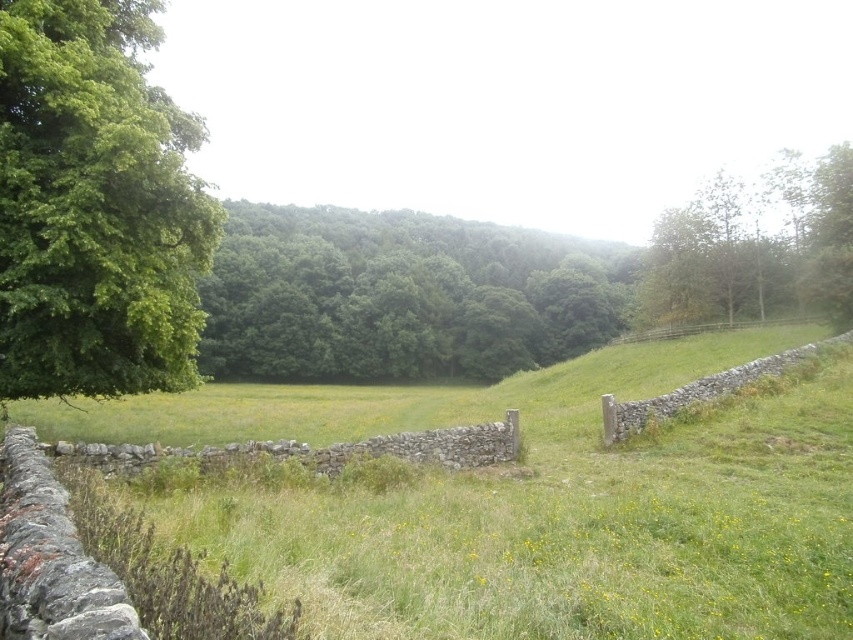
Between green leafy tree at upper right and dry stone wall at center, which one is positioned lower?

dry stone wall at center is lower down.

Does point (668, 282) come behind point (363, 449)?

Yes, it is behind point (363, 449).

Identify the location of green leafy tree at upper right. This screenshot has height=640, width=853. (x=753, y=250).

Is dry stone wall at center to the right of brown wooden fence at right from the viewer's perspective?

Incorrect, dry stone wall at center is not on the right side of brown wooden fence at right.

Between dry stone wall at center and brown wooden fence at right, which one is positioned lower?

dry stone wall at center

The width and height of the screenshot is (853, 640). Identify the location of dry stone wall at center. (315, 449).

Does green leafy tree at left have a lesser height compared to green leafy tree at upper right?

Correct, green leafy tree at left is not as tall as green leafy tree at upper right.

Does point (148, 104) lie behind point (723, 202)?

That is False.

Is point (26, 326) closer to camera compared to point (663, 241)?

Yes.

At what (x,y) coordinates should I click in order to perform the action: click on green leafy tree at left. Please return your answer as a coordinate pair (x, y). Looking at the image, I should click on (96, 205).